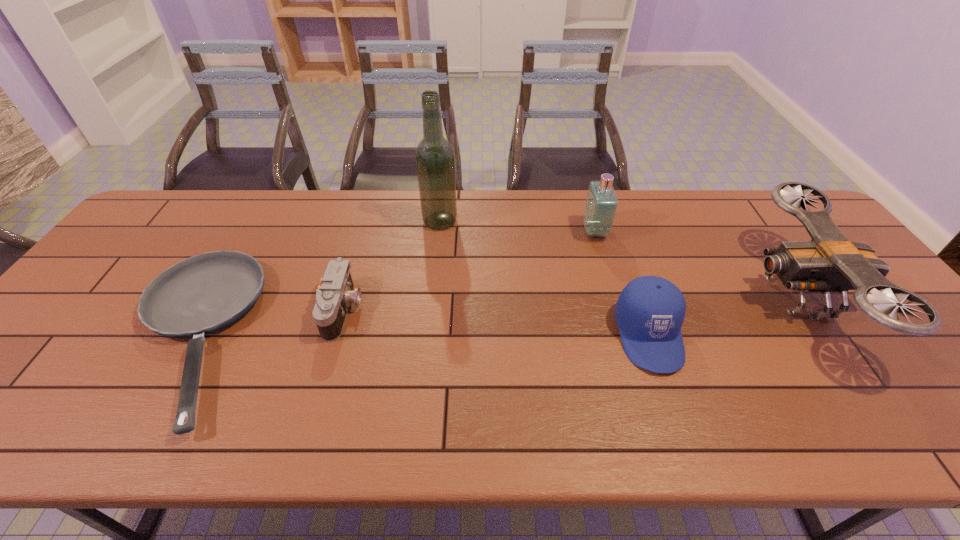
You are a GUI agent. You are given a task and a screenshot of the screen. Output one action in this format:
    pyautogui.click(x=<x>, y=<y>)
    Task: Click on the empty location between the perfume and the third shortest object
    The height and width of the screenshot is (540, 960).
    Given the screenshot: What is the action you would take?
    pyautogui.click(x=622, y=283)

Find the location of a particular element. free spot between the leftmost object and the tallest object is located at coordinates (314, 279).

Locate an element on the screen. The image size is (960, 540). unoccupied area between the leftmost object and the perfume is located at coordinates (392, 284).

The width and height of the screenshot is (960, 540). Find the location of `vacant area that lies between the perfume and the third shortest object`. vacant area that lies between the perfume and the third shortest object is located at coordinates (622, 283).

Where is `vacant space that's between the tallest object and the rightmost object`? This screenshot has height=540, width=960. vacant space that's between the tallest object and the rightmost object is located at coordinates (x=618, y=259).

What are the coordinates of `vacant point located between the perfume and the fourth tallest object` in the screenshot? It's located at (622, 283).

Where is `blank region between the perfume and the rightmost object`? blank region between the perfume and the rightmost object is located at coordinates (696, 265).

Locate which object is the third closest to the perfume. Please provide its 2D coordinates. Your answer should be formatted as a tuple, i.e. [(x, y)], where the tuple contains the x and y coordinates of a point satisfying the conditions above.

[(435, 162)]

Find the location of a particular element. object that is the second closest to the third shortest object is located at coordinates click(x=601, y=205).